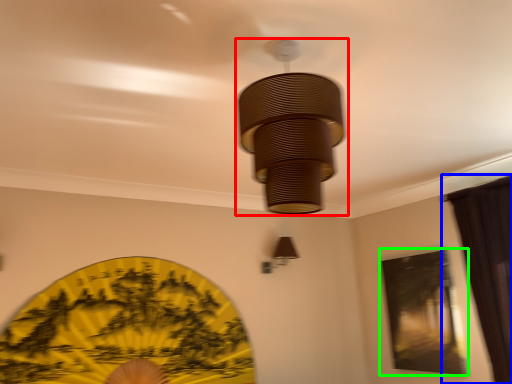
Question: Which object is the farthest from lamp (highlighted by a red box)? Choose among these: curtain (highlighted by a blue box) or window screen (highlighted by a green box).

Choices:
 (A) curtain
 (B) window screen

Answer: (B)